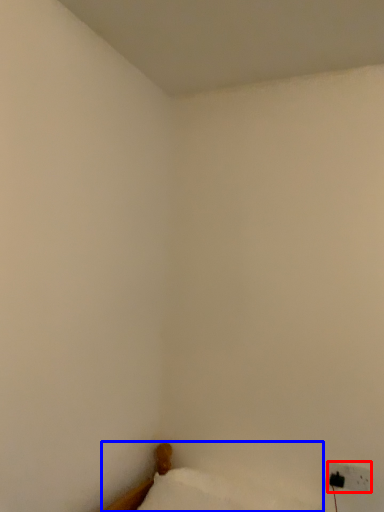
Question: Which object appears closest to the camera in this image, electric outlet (highlighted by a red box) or furniture (highlighted by a blue box)?

Choices:
 (A) electric outlet
 (B) furniture

Answer: (B)